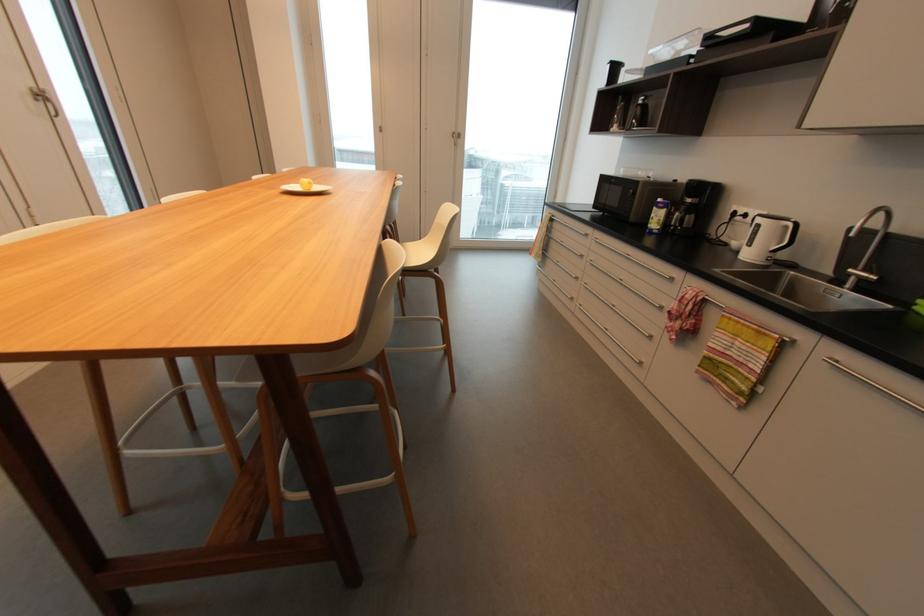
Where would you sitting on the chair sitting surface? Please return your answer as a coordinate pair (x, y).

(415, 252)